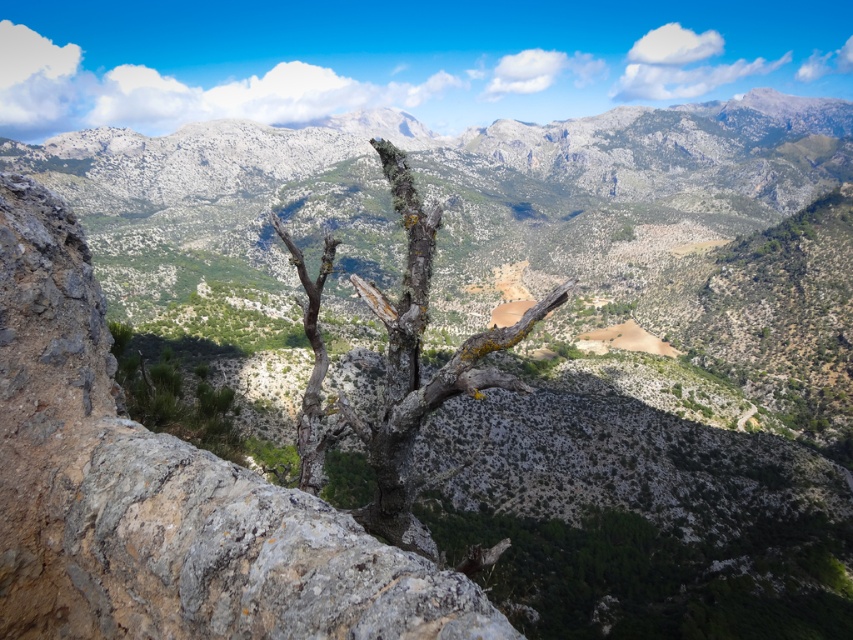
Does gray rough rock at center appear on the right side of gray rocky mountain range at upper center?

No, gray rough rock at center is not to the right of gray rocky mountain range at upper center.

Does gray rough rock at center have a lesser height compared to gray rocky mountain range at upper center?

Correct, gray rough rock at center is not as tall as gray rocky mountain range at upper center.

Is point (450, 625) behind point (390, 276)?

That is False.

Identify the location of gray rough rock at center. (163, 493).

What do you see at coordinates (439, 182) in the screenshot?
I see `gray rocky mountain range at upper center` at bounding box center [439, 182].

Does gray rocky mountain range at upper center have a larger size compared to gray rough bark tree at center?

Yes, gray rocky mountain range at upper center is bigger than gray rough bark tree at center.

Where is `gray rocky mountain range at upper center`? gray rocky mountain range at upper center is located at coordinates (439, 182).

Where is `gray rocky mountain range at upper center`? gray rocky mountain range at upper center is located at coordinates (439, 182).

The height and width of the screenshot is (640, 853). Find the location of `gray rough rock at center`. gray rough rock at center is located at coordinates (163, 493).

Who is positioned more to the right, gray rough rock at center or gray rough bark tree at center?

gray rough bark tree at center

Is point (248, 492) positioned after point (421, 310)?

No.

Image resolution: width=853 pixels, height=640 pixels. I want to click on gray rough rock at center, so click(163, 493).